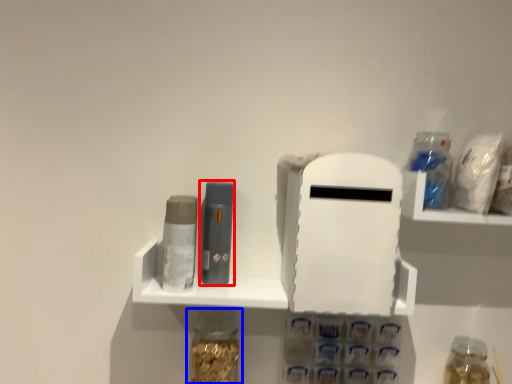
Question: Which object is further to the camera taking this photo, toiletry (highlighted by a red box) or bottle (highlighted by a blue box)?

Choices:
 (A) toiletry
 (B) bottle

Answer: (A)